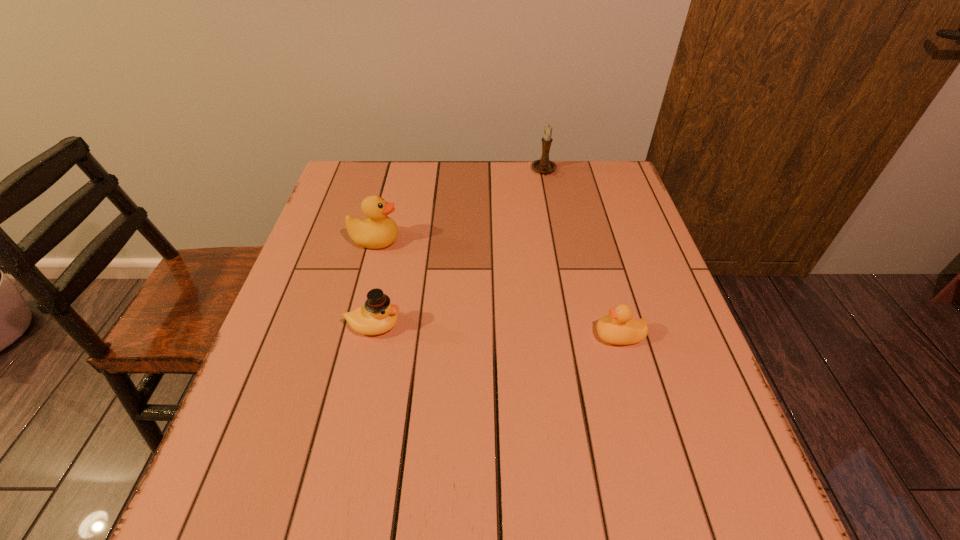
The width and height of the screenshot is (960, 540). I want to click on the second object from right to left, so click(x=544, y=165).

I want to click on candle holder, so click(x=544, y=165).

Find the location of a particular element. The height and width of the screenshot is (540, 960). the tallest duck is located at coordinates tap(378, 231).

Identify the location of the farthest duck. (378, 231).

The image size is (960, 540). What are the coordinates of `the rightmost duck` in the screenshot? It's located at (619, 328).

Where is `vacant space located 0.270m on the side of the candle holder with the handle`? The height and width of the screenshot is (540, 960). vacant space located 0.270m on the side of the candle holder with the handle is located at coordinates (557, 235).

In order to click on free space located at the beak of the third nearest object in this screenshot , I will do `click(521, 240)`.

Locate an element on the screen. vacant space located on the face of the rightmost object is located at coordinates (544, 335).

Image resolution: width=960 pixels, height=540 pixels. I want to click on free spot located 0.120m on the face of the rightmost object, so click(x=540, y=335).

I want to click on vacant space located on the face of the rightmost object, so click(x=413, y=335).